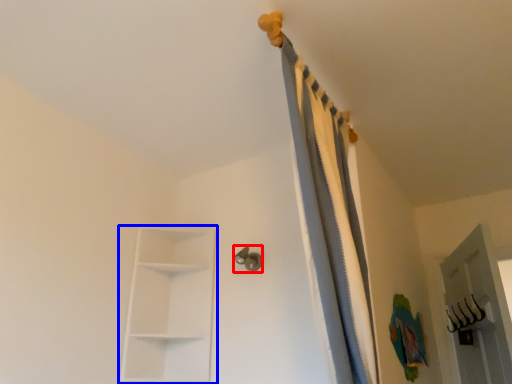
Question: Which object appears farthest to the camera in this image, door handle (highlighted by a red box) or shelf (highlighted by a blue box)?

Choices:
 (A) door handle
 (B) shelf

Answer: (A)